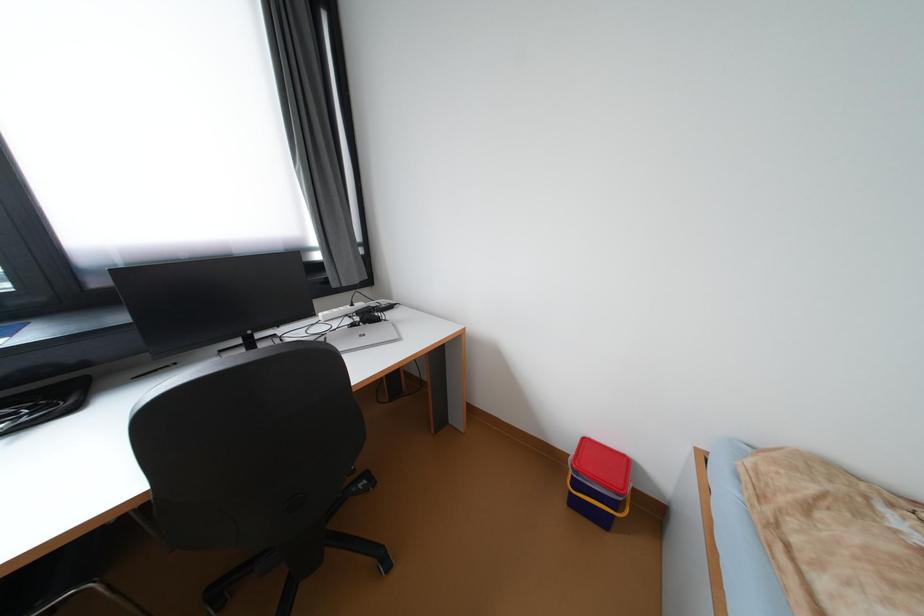
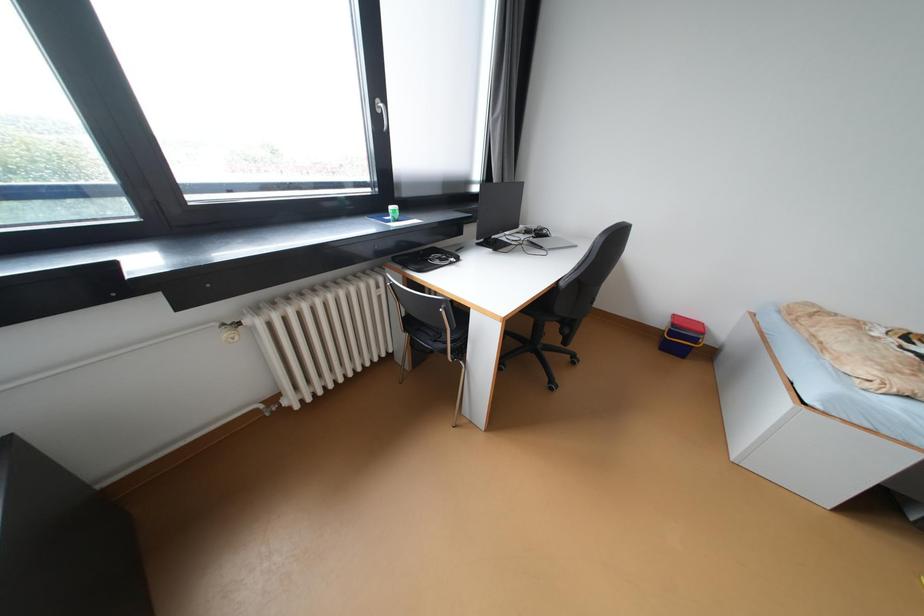
Which direction would the cameraman need to move to produce the second image?

The cameraman walked toward left, backward.